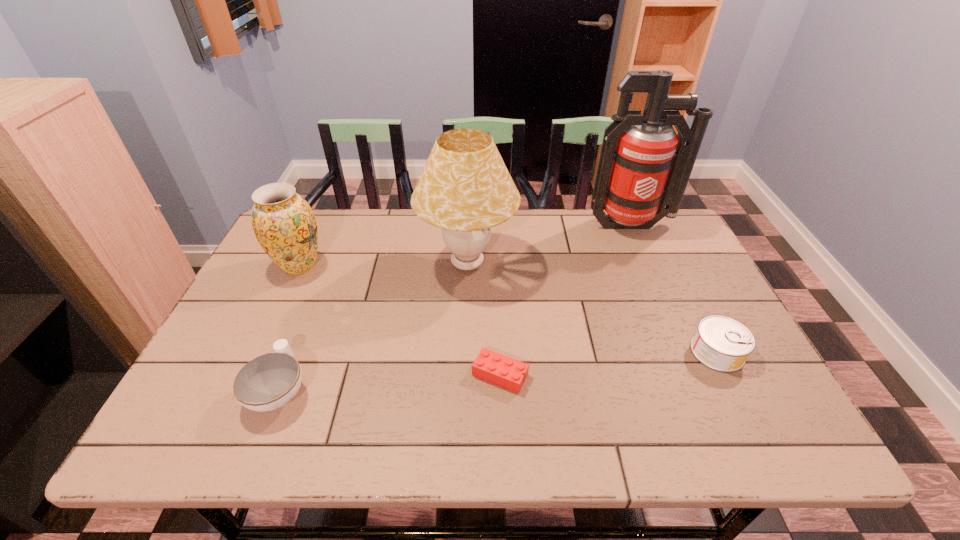
The height and width of the screenshot is (540, 960). Find the location of `fire extinguisher that is at the right edge`. fire extinguisher that is at the right edge is located at coordinates (644, 165).

I want to click on can that is at the right edge, so click(x=723, y=344).

The width and height of the screenshot is (960, 540). What are the coordinates of `object that is at the far left corner` in the screenshot? It's located at (284, 224).

Where is `object that is positioned at the near left corner`? object that is positioned at the near left corner is located at coordinates (269, 381).

I want to click on object that is at the far right corner, so click(x=644, y=165).

Image resolution: width=960 pixels, height=540 pixels. What are the coordinates of `free space at the far edge of the desktop` in the screenshot? It's located at (344, 231).

This screenshot has width=960, height=540. In the image, there is a desktop. In order to click on vacant region at the near edge in this screenshot , I will do `click(682, 410)`.

This screenshot has height=540, width=960. Find the location of `vacant point at the left edge`. vacant point at the left edge is located at coordinates (218, 363).

At what (x,y) coordinates should I click in order to perform the action: click on vacant space at the right edge of the desktop. Please return your answer as a coordinate pair (x, y). The width and height of the screenshot is (960, 540). Looking at the image, I should click on (694, 300).

Find the location of a particular element. The image size is (960, 540). free space between the can and the fourth shortest object is located at coordinates (508, 309).